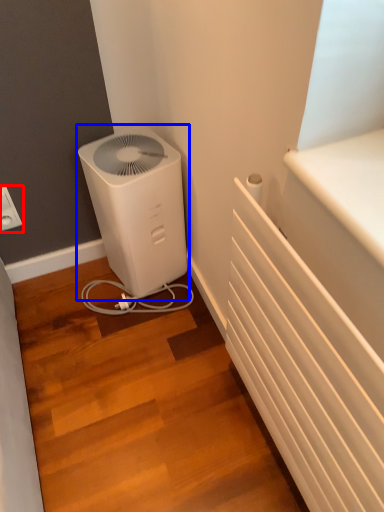
Question: Which point is closer to the camera, electric outlet (highlighted by a red box) or home appliance (highlighted by a blue box)?

Choices:
 (A) electric outlet
 (B) home appliance

Answer: (B)